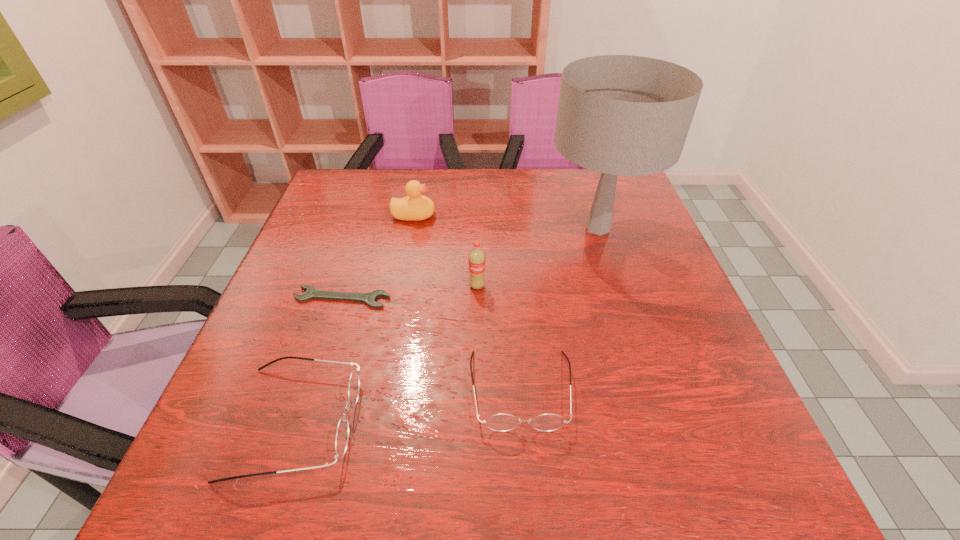
Where is `vacant space that's between the duck and the soda`? Image resolution: width=960 pixels, height=540 pixels. vacant space that's between the duck and the soda is located at coordinates (445, 251).

The height and width of the screenshot is (540, 960). I want to click on free space between the tallest object and the taller spectacles, so click(x=447, y=325).

Find the location of a particular element. The height and width of the screenshot is (540, 960). vacant space that's between the shorter spectacles and the fourth shortest object is located at coordinates pyautogui.click(x=468, y=302).

Where is `free space between the duck and the taller spectacles`? Image resolution: width=960 pixels, height=540 pixels. free space between the duck and the taller spectacles is located at coordinates (355, 319).

This screenshot has height=540, width=960. In order to click on vacant area between the shortest object and the second tallest object in this screenshot , I will do [x=410, y=292].

Where is `vacant region between the shortest object and the shorter spectacles`? The width and height of the screenshot is (960, 540). vacant region between the shortest object and the shorter spectacles is located at coordinates (431, 344).

Find the location of a particular element. free space between the soda and the second shortest object is located at coordinates (499, 338).

Where is `vacant space that's between the fourth shortest object and the shortest object`? The height and width of the screenshot is (540, 960). vacant space that's between the fourth shortest object and the shortest object is located at coordinates (378, 256).

Locate an element on the screen. the closest object to the third tallest object is located at coordinates (476, 260).

Identify which object is the nearest to the duck. Please provide its 2D coordinates. Your answer should be formatted as a tuple, i.e. [(x, y)], where the tuple contains the x and y coordinates of a point satisfying the conditions above.

[(476, 260)]